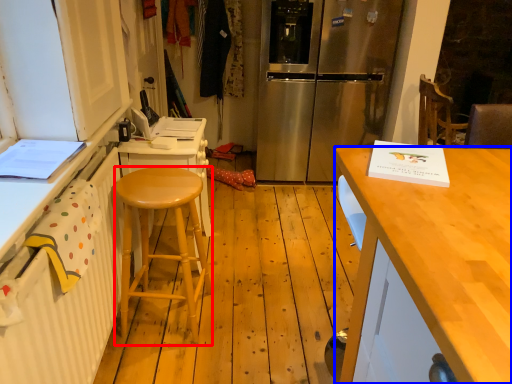
Question: Which of the following is the farthest to the observer, stool (highlighted by a red box) or desk (highlighted by a blue box)?

Choices:
 (A) stool
 (B) desk

Answer: (A)